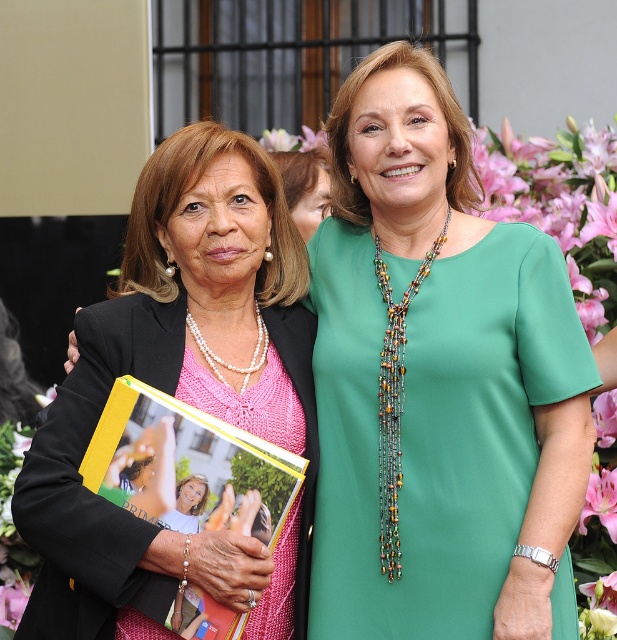
Is green fabric dress at center thinner than pink silk flower at upper center?

No, green fabric dress at center is not thinner than pink silk flower at upper center.

Which is more to the left, green fabric dress at center or pink silk flower at upper center?

pink silk flower at upper center

Locate an element on the screen. green fabric dress at center is located at coordinates (433, 426).

Is green fabric dress at center positioned behind pearl necklace at center?

Yes, it is.

Who is lower down, green fabric dress at center or pearl necklace at center?

green fabric dress at center is lower down.

Describe the element at coordinates (433, 426) in the screenshot. I see `green fabric dress at center` at that location.

I want to click on green fabric dress at center, so click(x=433, y=426).

Can you confirm if pearl necklace at center is taller than pink silk flower at upper center?

Yes.

Is pearl necklace at center bigger than pink silk flower at upper center?

Indeed, pearl necklace at center has a larger size compared to pink silk flower at upper center.

Between point (307, 339) and point (299, 138), which one is positioned behind?

The point (299, 138) is more distant.

Locate an element on the screen. pearl necklace at center is located at coordinates (181, 388).